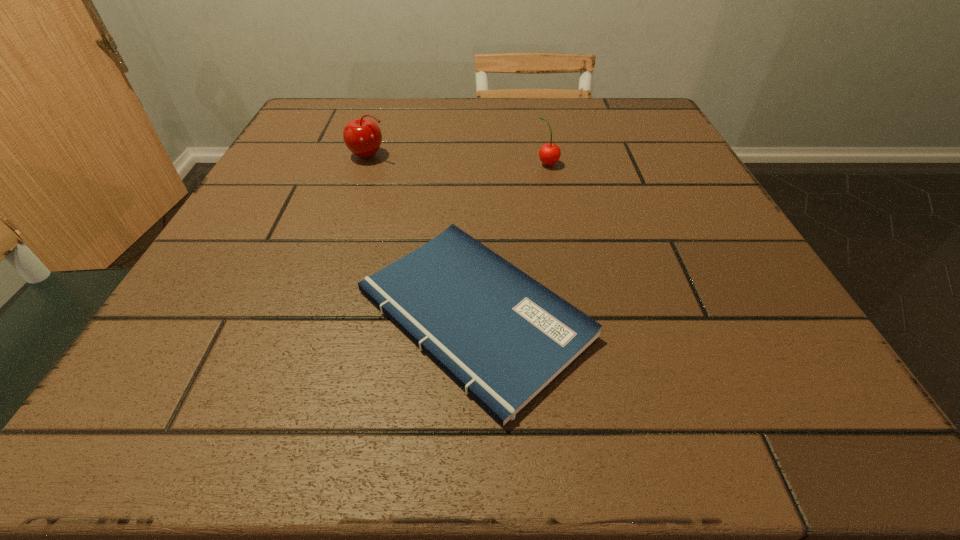
Locate an element on the screen. Image resolution: width=960 pixels, height=540 pixels. vacant area between the right cherry and the leftmost object is located at coordinates (458, 159).

At what (x,y) coordinates should I click in order to perform the action: click on free space between the left cherry and the right cherry. Please return your answer as a coordinate pair (x, y). This screenshot has width=960, height=540. Looking at the image, I should click on (458, 159).

Locate an element on the screen. empty location between the nearest object and the right cherry is located at coordinates (511, 239).

Identify the location of vacant point located between the nearest object and the left cherry. This screenshot has width=960, height=540. (420, 234).

Locate an element on the screen. The height and width of the screenshot is (540, 960). free point between the leftmost object and the right cherry is located at coordinates (458, 159).

Identify which object is located as the nearest to the right cherry. Please provide its 2D coordinates. Your answer should be formatted as a tuple, i.e. [(x, y)], where the tuple contains the x and y coordinates of a point satisfying the conditions above.

[(501, 335)]

Find the location of a particular element. Image resolution: width=960 pixels, height=540 pixels. the second closest object relative to the paperback book is located at coordinates (362, 136).

I want to click on vacant space that satisfies the following two spatial constraints: 1. on the front side of the left cherry; 2. on the left side of the shortest object, so click(x=313, y=314).